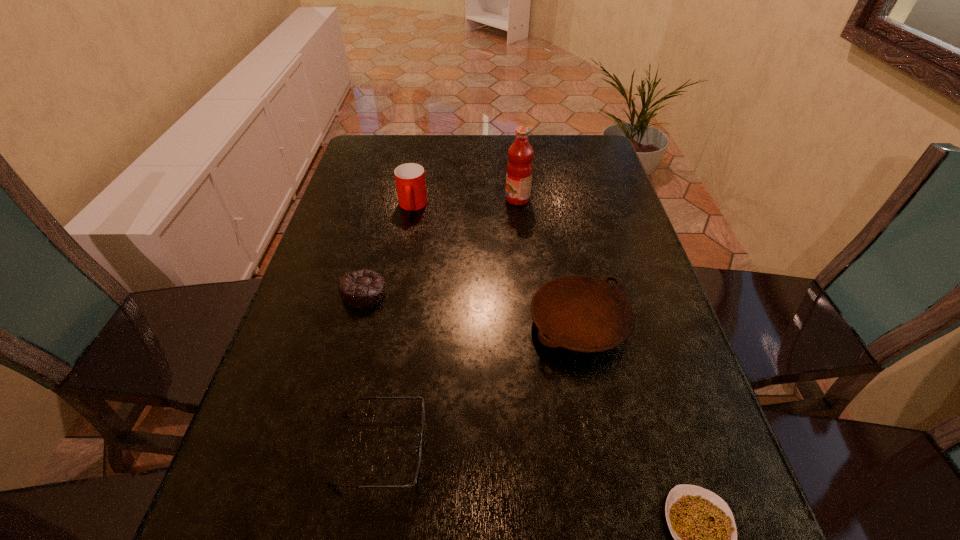
Identify the location of free spot that satisfies the following two spatial constraints: 1. on the front label of the fruit juice; 2. on the back side of the plate. The image size is (960, 540). (531, 323).

The height and width of the screenshot is (540, 960). In order to click on vacant region that satisfies the following two spatial constraints: 1. on the side of the second tallest object with the handle; 2. on the right side of the plate in this screenshot , I will do `click(391, 323)`.

Where is `vacant space that satisfies the following two spatial constraints: 1. on the front label of the tallest object; 2. on the side of the cup with the handle`? The image size is (960, 540). vacant space that satisfies the following two spatial constraints: 1. on the front label of the tallest object; 2. on the side of the cup with the handle is located at coordinates (518, 206).